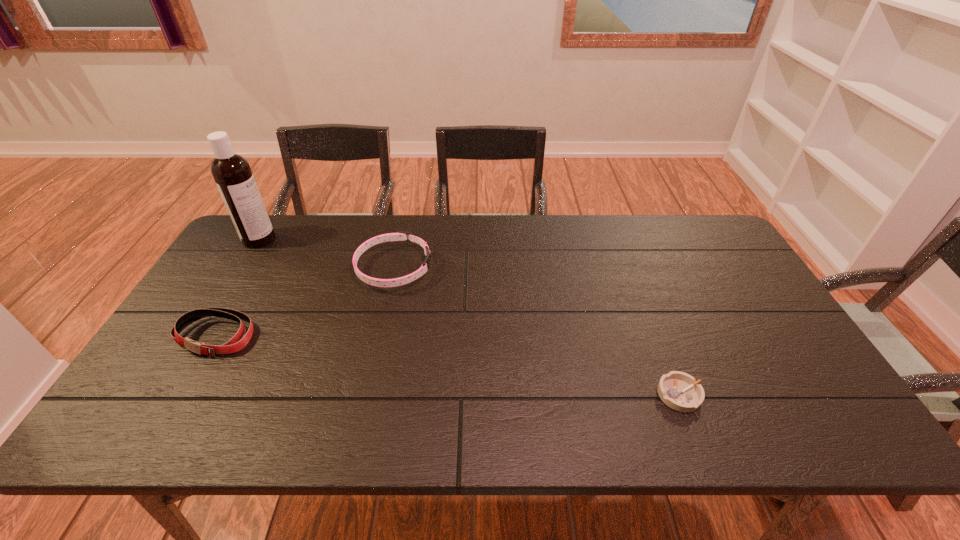
Locate an element on the screen. The image size is (960, 540). vacant space at the right edge of the desktop is located at coordinates (701, 285).

This screenshot has height=540, width=960. In the image, there is a desktop. Identify the location of vacant space at the far right corner. (719, 247).

Where is `empty location between the nearest object and the left dog collar`? empty location between the nearest object and the left dog collar is located at coordinates (447, 366).

You are a GUI agent. You are given a task and a screenshot of the screen. Output one action in this format:
    pyautogui.click(x=<x>, y=<y>)
    Task: Click on the vacant region between the nearer dog collar and the dishwasher detergent
    This screenshot has width=960, height=540.
    Given the screenshot: What is the action you would take?
    pyautogui.click(x=237, y=288)

The image size is (960, 540). In order to click on empty space between the ashtray and the second object from right to left in this screenshot , I will do `click(537, 332)`.

You are a GUI agent. You are given a task and a screenshot of the screen. Output one action in this format:
    pyautogui.click(x=<x>, y=<y>)
    Task: Click on the unoccupied position between the dishwasher detergent and the rightmost object
    
    Given the screenshot: What is the action you would take?
    pyautogui.click(x=469, y=317)

I want to click on free space between the right dog collar and the tallest object, so click(326, 254).

The image size is (960, 540). In order to click on unoccupied position between the third object from left to right and the shortest object in this screenshot , I will do `click(537, 332)`.

Where is `free spot between the tallest object and the farther dog collar`? free spot between the tallest object and the farther dog collar is located at coordinates (326, 254).

Image resolution: width=960 pixels, height=540 pixels. I want to click on vacant area that lies between the ashtray and the farther dog collar, so click(x=537, y=332).